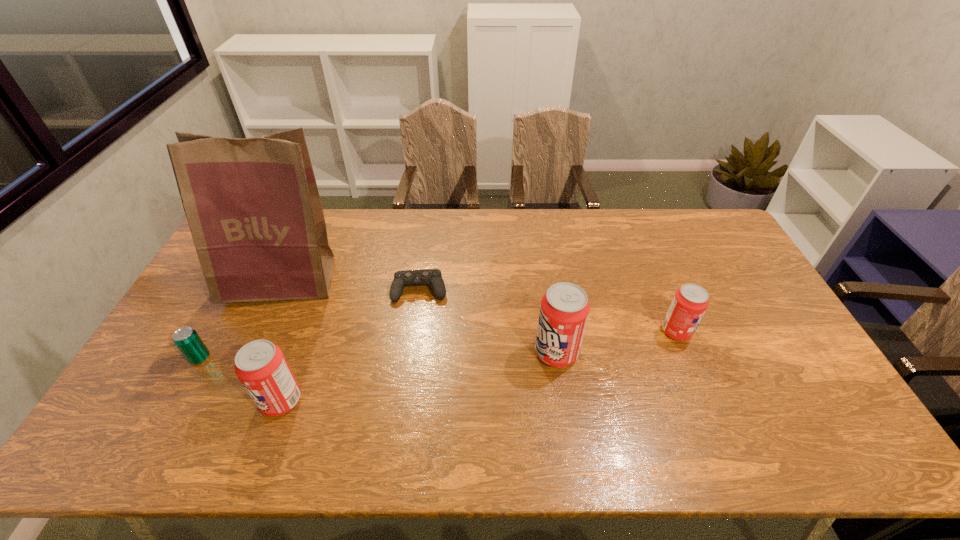
Identify the location of the nearest object. (260, 365).

The height and width of the screenshot is (540, 960). What are the coordinates of `the leftmost soda can` in the screenshot? It's located at (260, 365).

Locate an element on the screen. The height and width of the screenshot is (540, 960). the second object from right to left is located at coordinates (564, 310).

Locate an element on the screen. the shortest soda can is located at coordinates [690, 302].

Find the location of a particular element. This screenshot has width=960, height=540. the rightmost object is located at coordinates (690, 302).

This screenshot has height=540, width=960. In order to click on the tallest object in this screenshot , I will do `click(253, 208)`.

Identify the location of the second shortest object. (186, 339).

Identify the location of the shortest object. This screenshot has height=540, width=960. (433, 277).

Identify the location of control. (433, 277).

Locate an element on the screen. This screenshot has height=540, width=960. free location located on the surface of the nearest soda can is located at coordinates (135, 401).